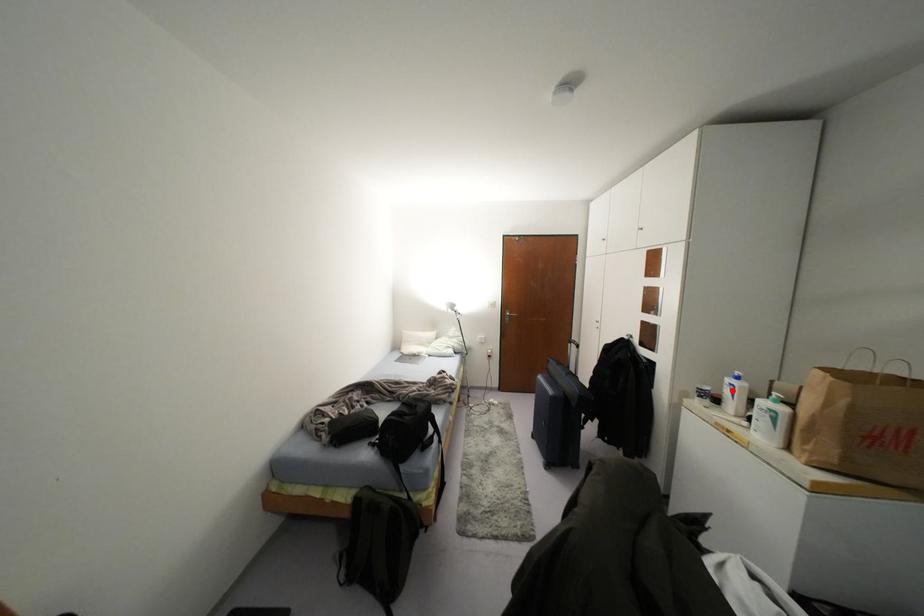
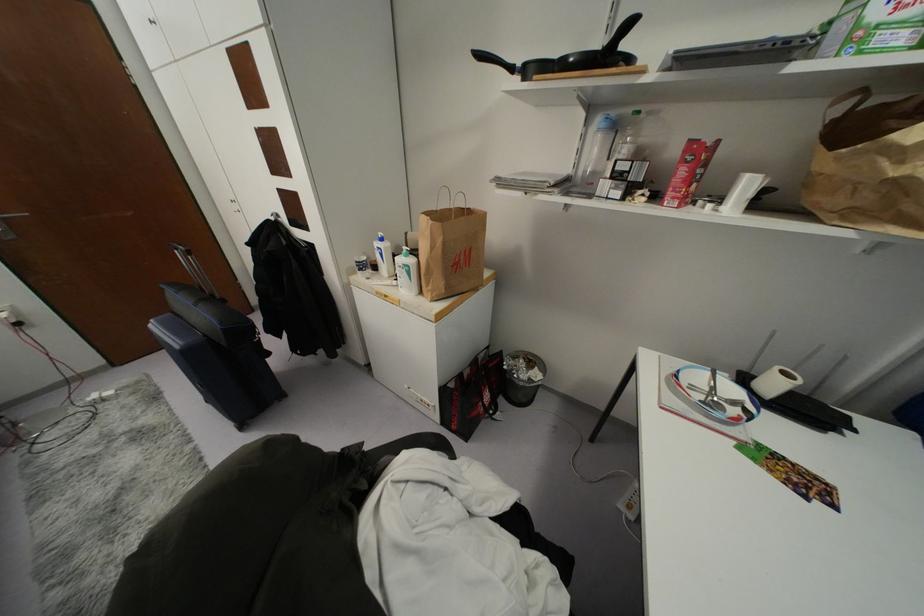
In the second image, find the point that corresponds to the highlighted location in the first image.

(381, 254)